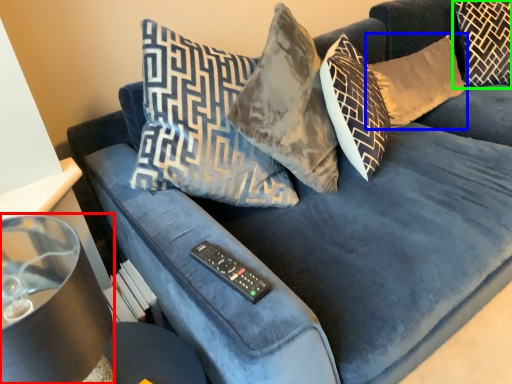
Question: Based on their relative distances, which object is farther from lamp (highlighted by a red box)? Choose from pillow (highlighted by a blue box) and pillow (highlighted by a green box).

Choices:
 (A) pillow
 (B) pillow

Answer: (B)